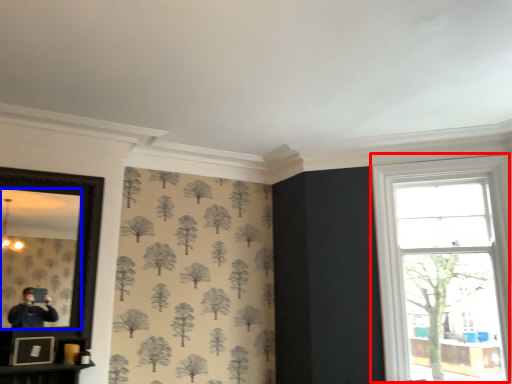
Question: Which object appears farthest to the camera in this image, window (highlighted by a red box) or mirror (highlighted by a blue box)?

Choices:
 (A) window
 (B) mirror

Answer: (A)